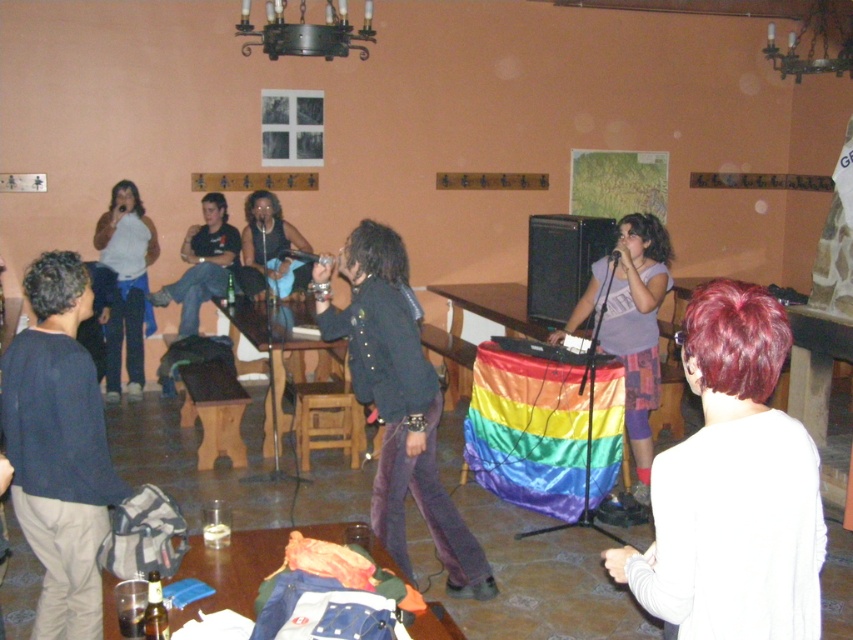
Measure the distance between point (32,426) and camera.

A distance of 8.94 feet exists between point (32,426) and camera.

Is dark blue sweater at left bigger than rainbow fabric dj booth at center?

→ Actually, dark blue sweater at left might be smaller than rainbow fabric dj booth at center.

Which is in front, point (84, 403) or point (636, 321)?

Point (84, 403) is more forward.

This screenshot has width=853, height=640. Identify the location of dark blue sweater at left. (59, 448).

Is matte black jacket at left shorter than dark blue jeans at center?

No.

Between point (119, 358) and point (189, 275), which one is positioned behind?

The point (119, 358) is more distant.

Locate an element on the screen. The height and width of the screenshot is (640, 853). matte black jacket at left is located at coordinates [x=126, y=284].

Does point (724, 365) come farther from viewer compared to point (83, 432)?

That is False.

Image resolution: width=853 pixels, height=640 pixels. Describe the element at coordinates (733, 486) in the screenshot. I see `white matte shirt at lower right` at that location.

Image resolution: width=853 pixels, height=640 pixels. I want to click on white matte shirt at lower right, so click(x=733, y=486).